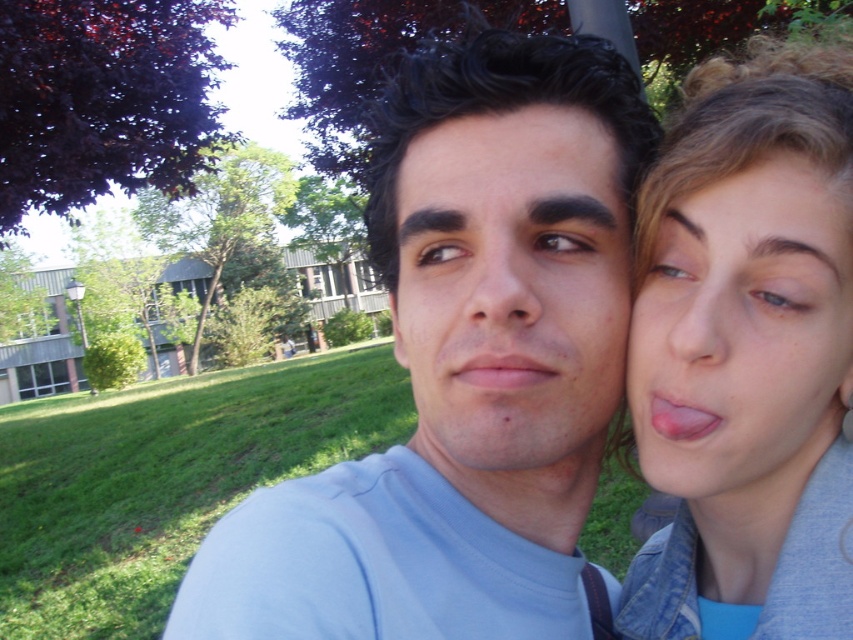
Is light blue t-shirt at center smaller than matte skin forehead at center?

Incorrect, light blue t-shirt at center is not smaller in size than matte skin forehead at center.

The height and width of the screenshot is (640, 853). Find the location of `light blue t-shirt at center`. light blue t-shirt at center is located at coordinates (463, 364).

Does point (419, 538) come farther from viewer compared to point (523, 141)?

Yes.

At what (x,y) coordinates should I click in order to perform the action: click on light blue t-shirt at center. Please return your answer as a coordinate pair (x, y). Image resolution: width=853 pixels, height=640 pixels. Looking at the image, I should click on (463, 364).

Who is shorter, matte gray jacket at right or matte skin forehead at center?

matte skin forehead at center

Which is in front, point (833, 145) or point (595, 145)?

Point (833, 145) is more forward.

At what (x,y) coordinates should I click in order to perform the action: click on matte gray jacket at right. Please return your answer as a coordinate pair (x, y). Looking at the image, I should click on (747, 355).

Is point (399, 632) positioned before point (616, 292)?

Yes.

Who is higher up, light blue t-shirt at center or matte skin face at center?

light blue t-shirt at center is higher up.

What do you see at coordinates (463, 364) in the screenshot?
I see `light blue t-shirt at center` at bounding box center [463, 364].

At what (x,y) coordinates should I click in order to perform the action: click on light blue t-shirt at center. Please return your answer as a coordinate pair (x, y). Image resolution: width=853 pixels, height=640 pixels. Looking at the image, I should click on (463, 364).